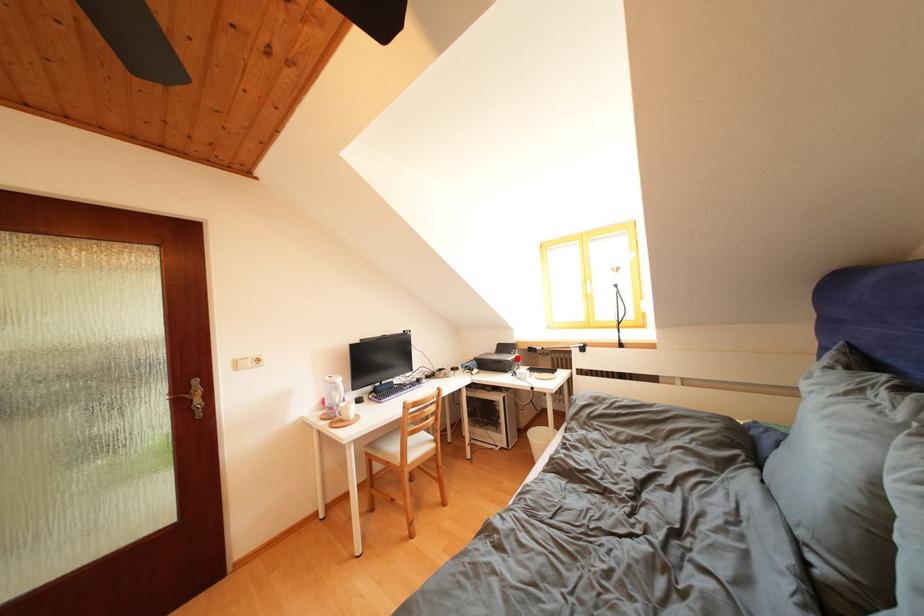
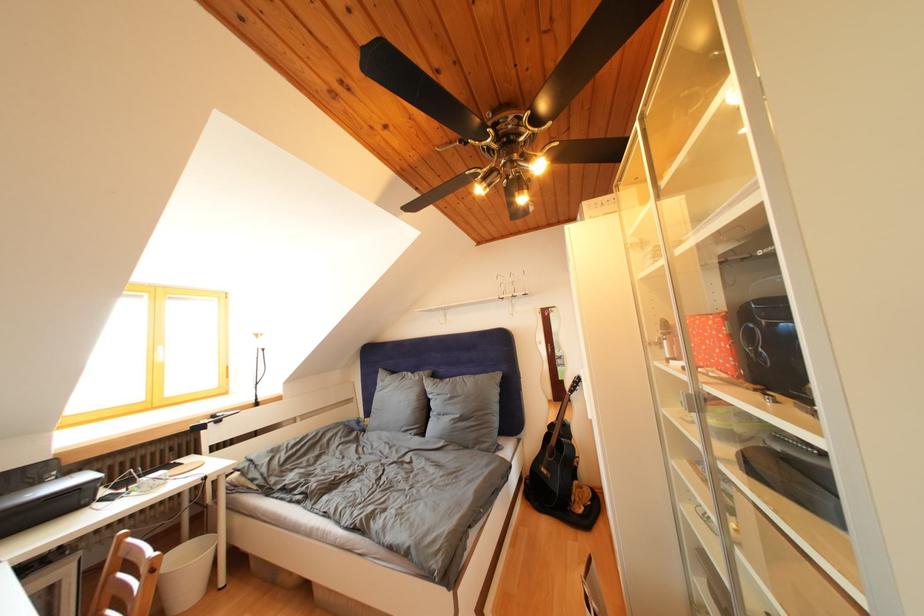
Locate, in the second image, the point that corresponds to the highlighted location in the first image.

(44, 488)